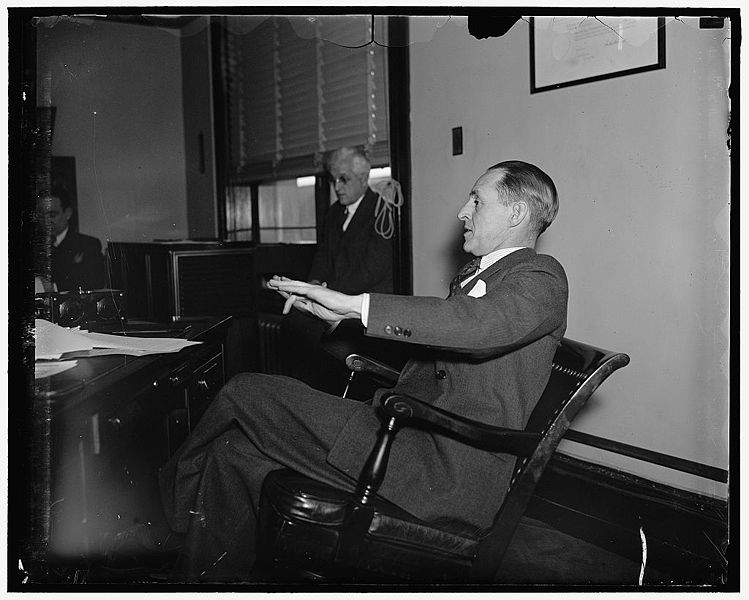
Locate an element on the screen. old telephone is located at coordinates (94, 311).